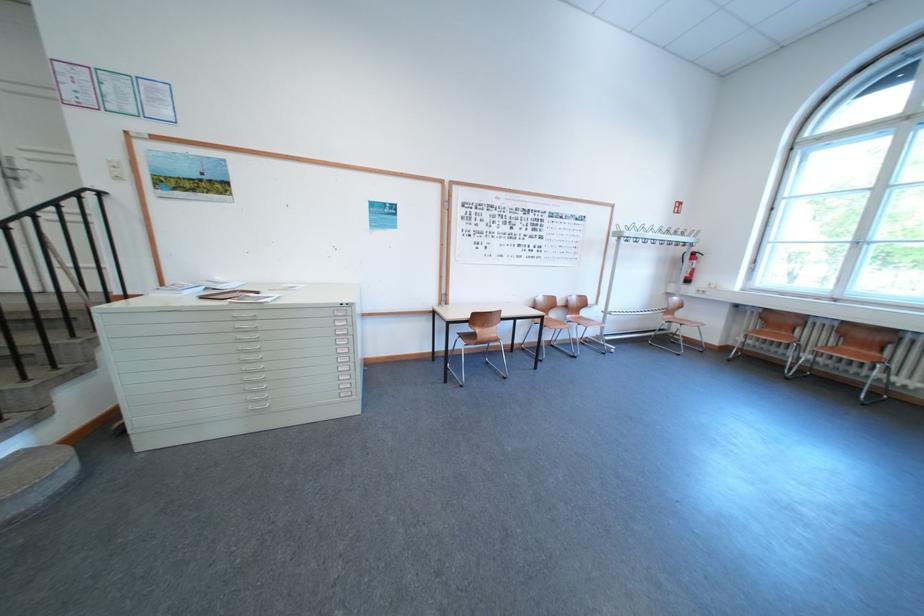
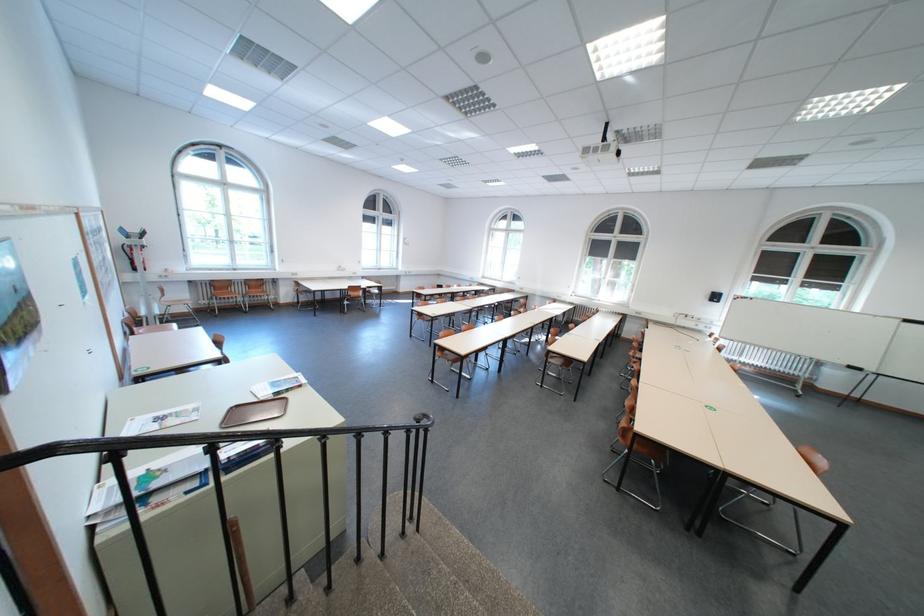
In the second image, find the point that corresponds to the point at 762,323 in the first image.

(219, 292)